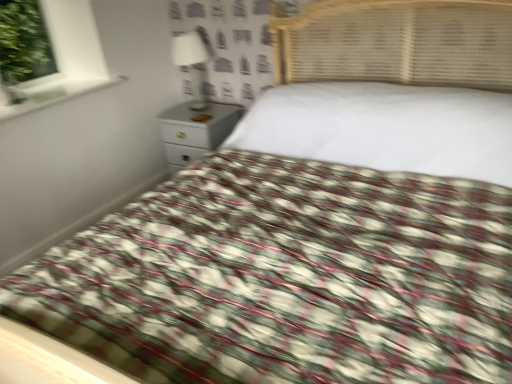
What are the coordinates of `white glossy lamp at upper center` in the screenshot? It's located at (192, 63).

The width and height of the screenshot is (512, 384). What do you see at coordinates (52, 93) in the screenshot? I see `white glossy window sill at upper left` at bounding box center [52, 93].

This screenshot has width=512, height=384. In order to click on white glossy window sill at upper left in this screenshot , I will do `click(52, 93)`.

What do you see at coordinates (195, 131) in the screenshot? Image resolution: width=512 pixels, height=384 pixels. I see `white glossy nightstand at upper center` at bounding box center [195, 131].

Find the location of a particular element. The image size is (512, 384). white glossy lamp at upper center is located at coordinates (192, 63).

Considering the sizes of objects white glossy window sill at upper left and white glossy lamp at upper center in the image provided, who is wider, white glossy window sill at upper left or white glossy lamp at upper center?

→ white glossy window sill at upper left is wider.

Between white glossy window sill at upper left and white glossy lamp at upper center, which one appears on the left side from the viewer's perspective?

From the viewer's perspective, white glossy window sill at upper left appears more on the left side.

Are white glossy window sill at upper left and white glossy lamp at upper center beside each other?

white glossy window sill at upper left and white glossy lamp at upper center are clearly separated.

Could you tell me if white glossy window sill at upper left is facing white glossy nightstand at upper center?

No.

Is white glossy window sill at upper left surrounding white glossy nightstand at upper center?

No, white glossy nightstand at upper center is not inside white glossy window sill at upper left.

Is point (47, 83) closer or farther from the camera than point (224, 131)?

Point (47, 83) is closer to the camera than point (224, 131).

Is white glossy lamp at upper center oriented away from white glossy window sill at upper left?

white glossy lamp at upper center is not turned away from white glossy window sill at upper left.

Is white glossy lamp at upper center situated inside white glossy window sill at upper left or outside?

white glossy lamp at upper center is not inside white glossy window sill at upper left, it's outside.

Is white glossy lamp at upper center to the left of white glossy window sill at upper left from the viewer's perspective?

Incorrect, white glossy lamp at upper center is not on the left side of white glossy window sill at upper left.

Is white glossy lamp at upper center bigger or smaller than white glossy nightstand at upper center?

Considering their sizes, white glossy lamp at upper center takes up less space than white glossy nightstand at upper center.

Which of these two, white glossy lamp at upper center or white glossy nightstand at upper center, stands shorter?

Standing shorter between the two is white glossy lamp at upper center.

Is the depth of white glossy lamp at upper center greater than that of white glossy nightstand at upper center?

No, the depth of white glossy lamp at upper center is less than that of white glossy nightstand at upper center.

Based on the photo, is white glossy nightstand at upper center situated inside white glossy lamp at upper center or outside?

white glossy nightstand at upper center is located beyond the bounds of white glossy lamp at upper center.

Is white glossy nightstand at upper center thinner than white glossy lamp at upper center?

No, white glossy nightstand at upper center is not thinner than white glossy lamp at upper center.

Does white glossy nightstand at upper center have a lesser height compared to white glossy lamp at upper center?

In fact, white glossy nightstand at upper center may be taller than white glossy lamp at upper center.

Is white glossy nightstand at upper center facing away from white glossy lamp at upper center?

No, white glossy lamp at upper center is not at the back of white glossy nightstand at upper center.

From a real-world perspective, between white glossy nightstand at upper center and white glossy window sill at upper left, who is vertically higher?

From a 3D spatial view, white glossy window sill at upper left is above.

Considering the sizes of objects white glossy nightstand at upper center and white glossy window sill at upper left in the image provided, who is shorter, white glossy nightstand at upper center or white glossy window sill at upper left?

white glossy window sill at upper left.

Considering the relative positions of white glossy nightstand at upper center and white glossy window sill at upper left in the image provided, is white glossy nightstand at upper center to the right of white glossy window sill at upper left from the viewer's perspective?

Correct, you'll find white glossy nightstand at upper center to the right of white glossy window sill at upper left.

Is white glossy window sill at upper left located within white glossy nightstand at upper center?

No, white glossy window sill at upper left is located outside of white glossy nightstand at upper center.

At what (x,y) coordinates should I click in order to perform the action: click on window sill to the left of white glossy lamp at upper center. Please return your answer as a coordinate pair (x, y). Looking at the image, I should click on (52, 93).

Where is `window sill above the white glossy nightstand at upper center (from a real-world perspective)`? window sill above the white glossy nightstand at upper center (from a real-world perspective) is located at coordinates (52, 93).

Based on the photo, considering their positions, is white glossy window sill at upper left positioned closer to white glossy lamp at upper center than white glossy nightstand at upper center?

The object closer to white glossy lamp at upper center is white glossy nightstand at upper center.

Looking at the image, which one is located closer to white glossy nightstand at upper center, white glossy lamp at upper center or white glossy window sill at upper left?

Based on the image, white glossy lamp at upper center appears to be nearer to white glossy nightstand at upper center.

Estimate the real-world distances between objects in this image. Which object is further from white glossy window sill at upper left, white glossy lamp at upper center or white glossy nightstand at upper center?

white glossy lamp at upper center is further to white glossy window sill at upper left.

Based on their spatial positions, is white glossy nightstand at upper center or white glossy lamp at upper center further from white glossy window sill at upper left?

white glossy lamp at upper center.

Considering their positions, is white glossy window sill at upper left positioned closer to white glossy nightstand at upper center than white glossy lamp at upper center?

white glossy lamp at upper center lies closer to white glossy nightstand at upper center than the other object.

Based on their spatial positions, is white glossy nightstand at upper center or white glossy window sill at upper left further from white glossy lamp at upper center?

white glossy window sill at upper left.

Image resolution: width=512 pixels, height=384 pixels. What are the coordinates of `lamp between white glossy window sill at upper left and white glossy nightstand at upper center` in the screenshot? It's located at (192, 63).